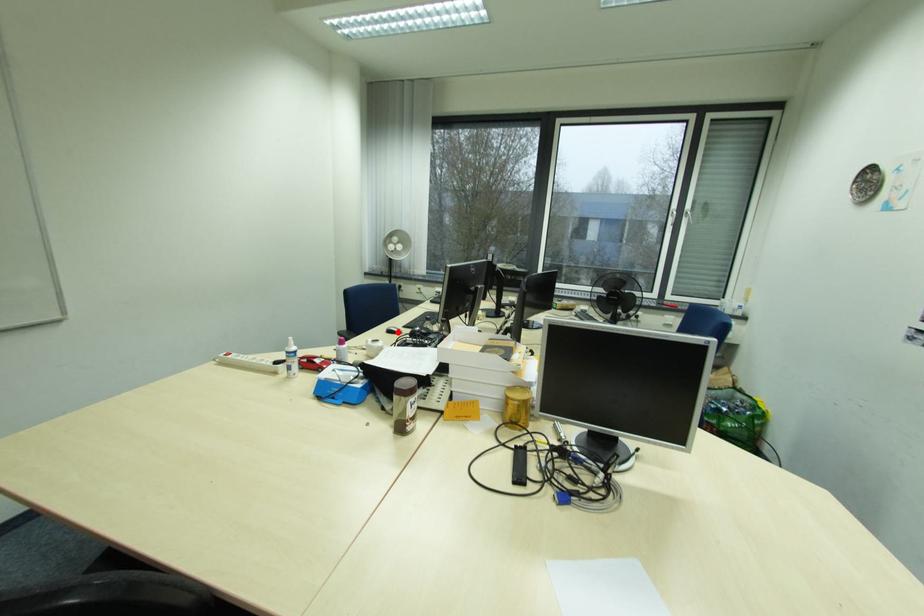
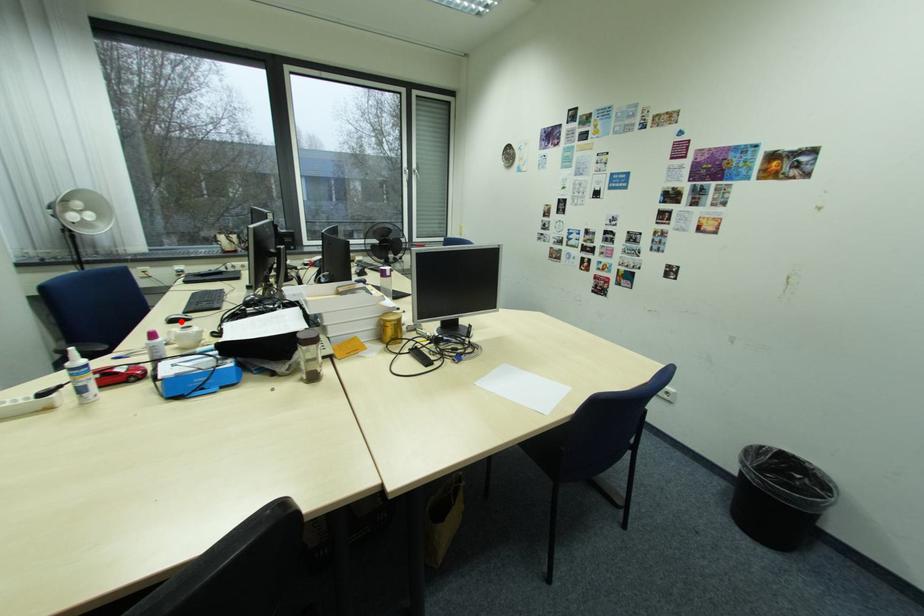
I am providing you with two images of the same scene from different viewpoints. A red point is marked on the first image and another point is marked on the second image. Does the point marked in image1 correspond to the same location as the one in image2?

Yes